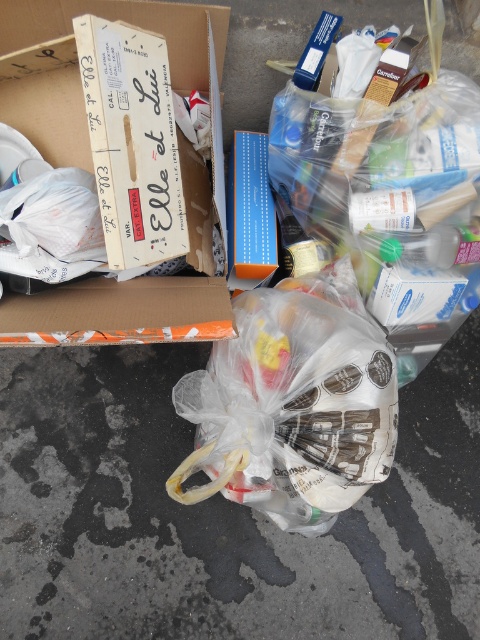
Question: Does clear plastic bag at center appear on the right side of white cardboard box at upper left?

Choices:
 (A) no
 (B) yes

Answer: (B)

Question: Is clear plastic bag at center positioned behind white cardboard box at upper left?

Choices:
 (A) yes
 (B) no

Answer: (A)

Question: Which object appears farthest from the camera in this image?

Choices:
 (A) white cardboard box at upper left
 (B) clear plastic bag at center

Answer: (B)

Question: Which point is farther to the camera?

Choices:
 (A) (68, 150)
 (B) (193, 456)

Answer: (B)

Question: Is clear plastic bag at center positioned behind white cardboard box at upper left?

Choices:
 (A) yes
 (B) no

Answer: (A)